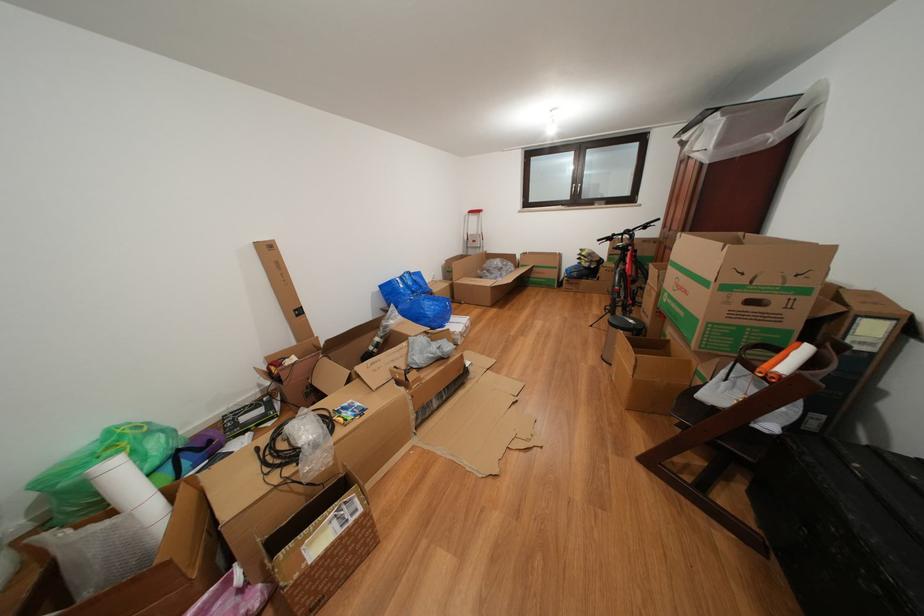
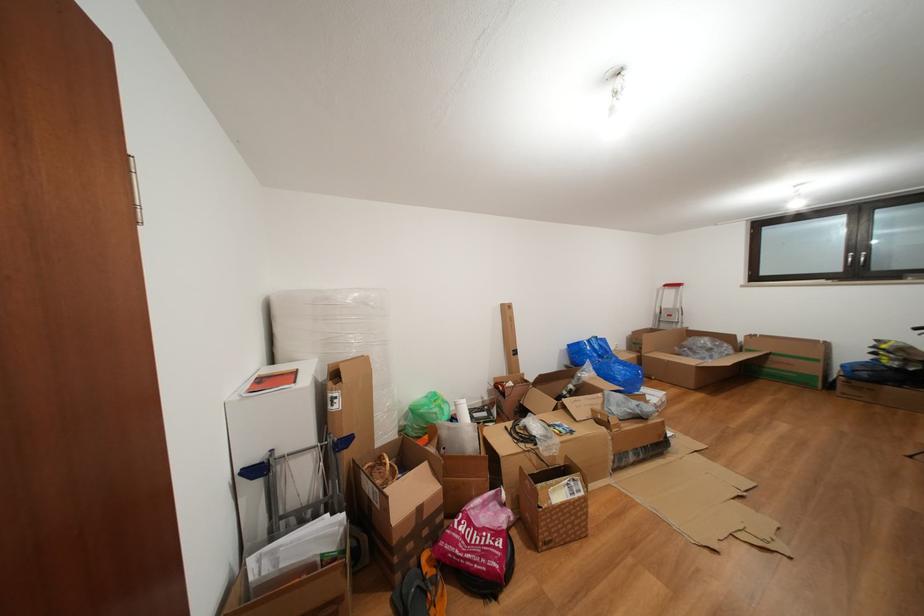
Locate, in the second image, the point that corresponds to pixel 408 283 in the first image.

(597, 346)